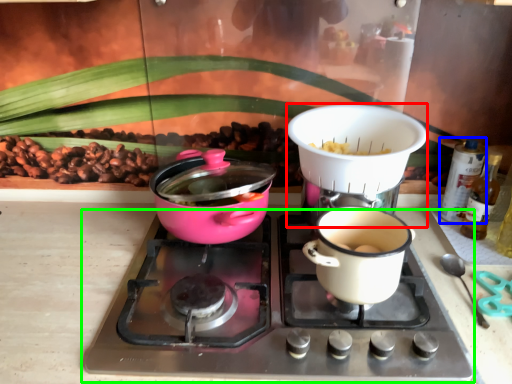
Question: Considering the real-world distances, which object is closest to appliance (highlighted by a red box)? bottle (highlighted by a blue box) or gas stove (highlighted by a green box).

Choices:
 (A) bottle
 (B) gas stove

Answer: (B)